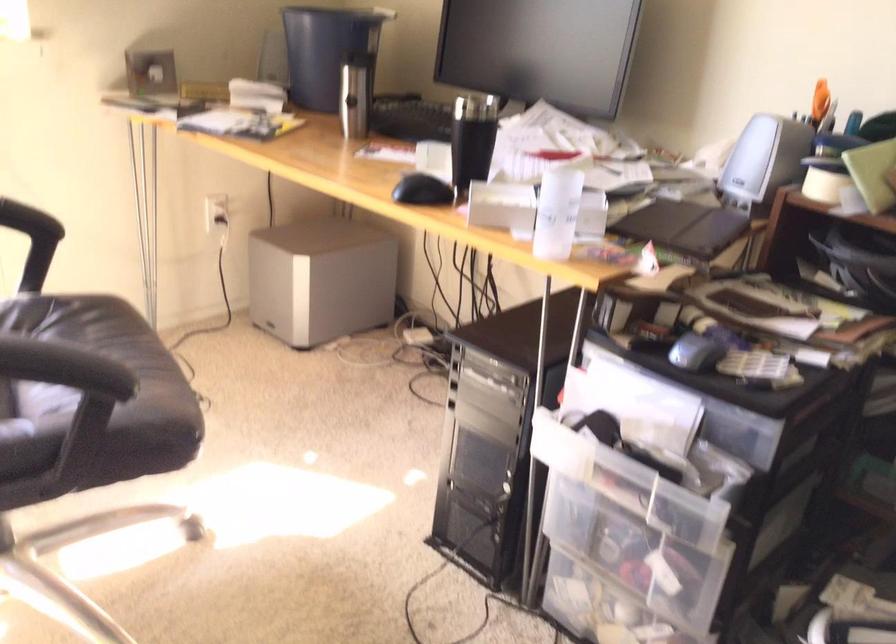
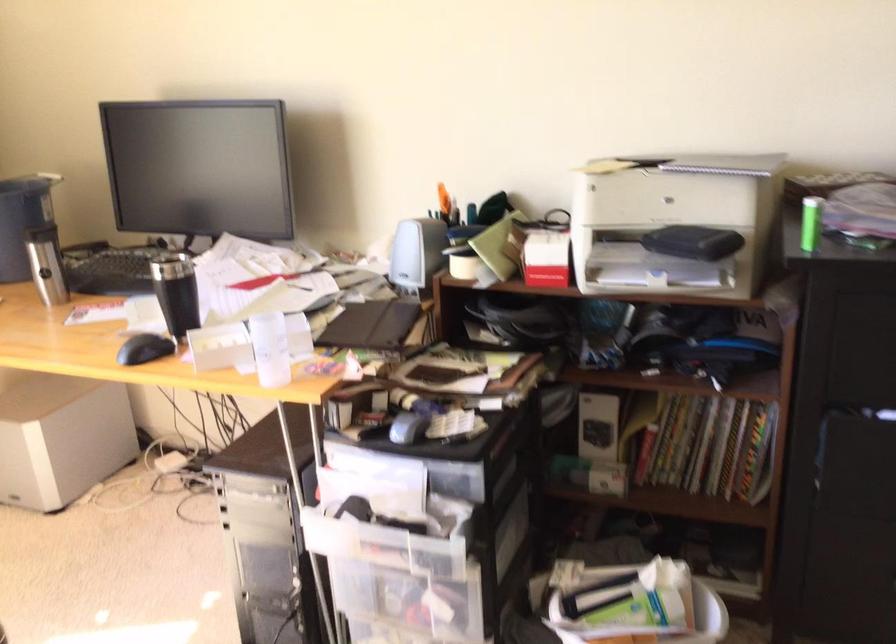
In the second image, find the point that corresponds to (x=467, y=137) in the first image.

(176, 292)